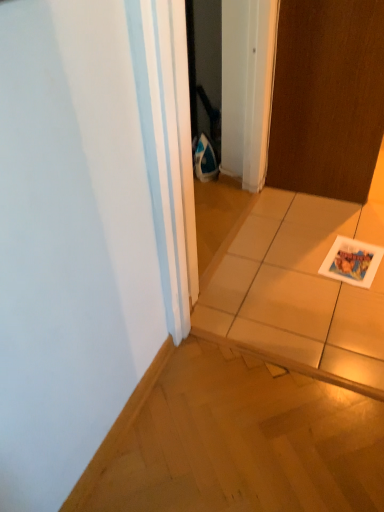
Question: Does white glossy tile at center have a lesser width compared to brown matte door at upper right?

Choices:
 (A) no
 (B) yes

Answer: (A)

Question: From the image's perspective, is white glossy tile at center located beneath brown matte door at upper right?

Choices:
 (A) no
 (B) yes

Answer: (B)

Question: Is white glossy tile at center closer to the viewer compared to brown matte door at upper right?

Choices:
 (A) no
 (B) yes

Answer: (B)

Question: Is white glossy tile at center facing away from brown matte door at upper right?

Choices:
 (A) no
 (B) yes

Answer: (A)

Question: Does white glossy tile at center have a larger size compared to brown matte door at upper right?

Choices:
 (A) yes
 (B) no

Answer: (A)

Question: Relative to white glossy tile at center, is white glossy postcard at lower right in front or behind?

Choices:
 (A) front
 (B) behind

Answer: (B)

Question: From the image's perspective, is white glossy postcard at lower right positioned above or below white glossy tile at center?

Choices:
 (A) above
 (B) below

Answer: (B)

Question: In terms of width, does white glossy postcard at lower right look wider or thinner when compared to white glossy tile at center?

Choices:
 (A) thin
 (B) wide

Answer: (A)

Question: Is white glossy postcard at lower right inside or outside of white glossy tile at center?

Choices:
 (A) outside
 (B) inside

Answer: (B)

Question: Looking at their shapes, would you say brown matte door at upper right is wider or thinner than white glossy postcard at lower right?

Choices:
 (A) wide
 (B) thin

Answer: (B)

Question: From a real-world perspective, is brown matte door at upper right above or below white glossy postcard at lower right?

Choices:
 (A) below
 (B) above

Answer: (B)

Question: Is brown matte door at upper right in front of or behind white glossy postcard at lower right in the image?

Choices:
 (A) behind
 (B) front

Answer: (B)

Question: Considering the positions of point (307, 68) and point (372, 270), is point (307, 68) closer or farther from the camera than point (372, 270)?

Choices:
 (A) closer
 (B) farther

Answer: (B)

Question: Is brown matte door at upper right taller or shorter than white glossy tile at center?

Choices:
 (A) short
 (B) tall

Answer: (B)

Question: From the image's perspective, relative to white glossy tile at center, is brown matte door at upper right above or below?

Choices:
 (A) above
 (B) below

Answer: (A)